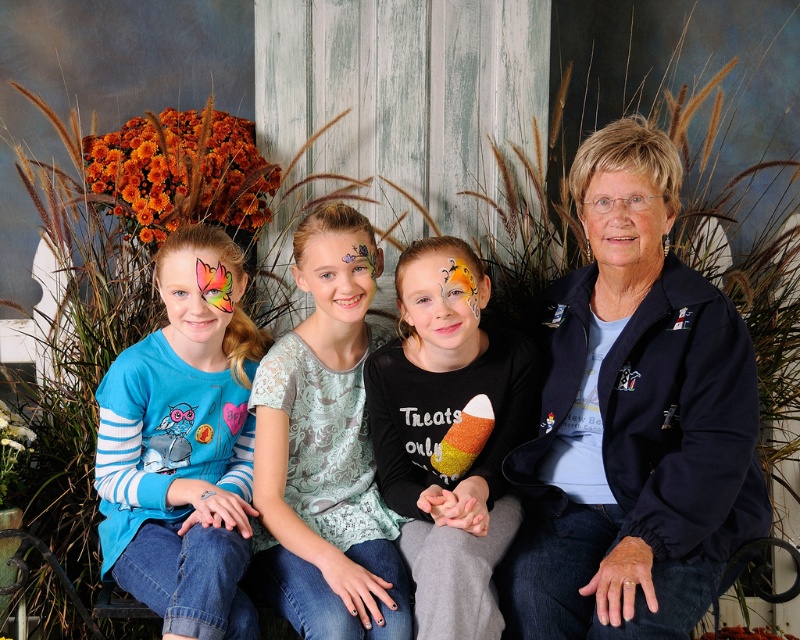
Question: Estimate the real-world distances between objects in this image. Which object is farther from the matte blue shirt at left?

Choices:
 (A) matte colorful butterfly at left
 (B) matte black jacket at center
 (C) matte orange butterfly at center
 (D) matte black jacket at upper right

Answer: (D)

Question: Which point is closer to the camera?

Choices:
 (A) glittery yellow ice cream cone at center
 (B) matte blue shirt at left

Answer: (B)

Question: Can you confirm if navy blue jacket at right is bigger than glittery yellow ice cream cone at center?

Choices:
 (A) no
 (B) yes

Answer: (B)

Question: In this image, where is matte black shirt with candy corn design at center located relative to matte black jacket at upper right?

Choices:
 (A) below
 (B) above

Answer: (A)

Question: Based on their relative distances, which object is farther from the matte orange butterfly at center?

Choices:
 (A) lace fabric shirt at center
 (B) matte black jacket at upper right
 (C) glittery yellow ice cream cone at center

Answer: (B)

Question: Can you confirm if matte black jacket at center is thinner than matte blue shirt at left?

Choices:
 (A) no
 (B) yes

Answer: (A)